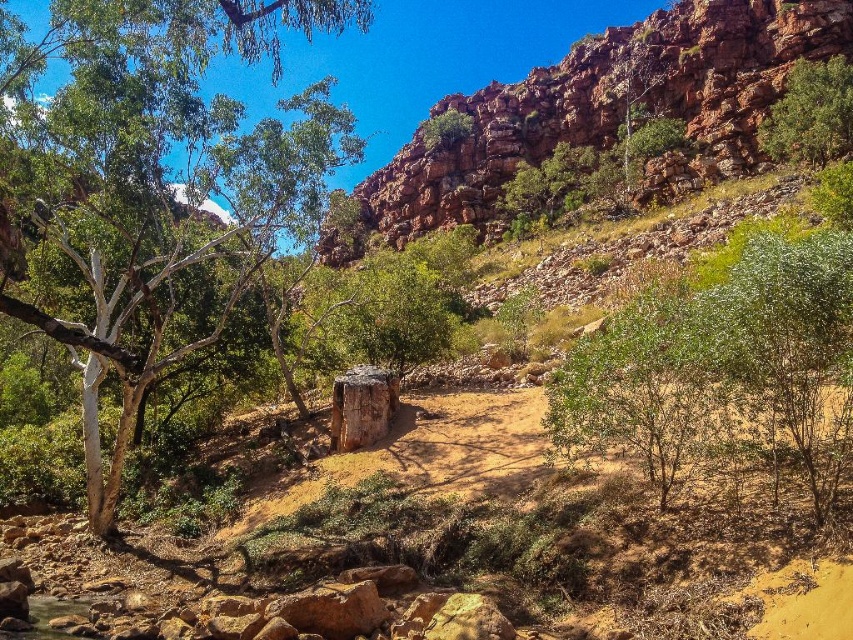
Is green leafy bush at lower right below rusty rock cliff at upper right?

Yes.

Measure the distance between point (838, 448) and camera.

27.72 meters

Identify the location of green leafy bush at lower right. (723, 364).

Does green leafy tree at left have a lesser height compared to rusty rock cliff at upper right?

Incorrect, green leafy tree at left's height does not fall short of rusty rock cliff at upper right's.

Between point (151, 26) and point (721, 136), which one is positioned in front?

Point (151, 26)

Image resolution: width=853 pixels, height=640 pixels. I want to click on green leafy tree at left, so click(x=137, y=179).

This screenshot has width=853, height=640. Describe the element at coordinates (811, 115) in the screenshot. I see `green leafy tree at upper right` at that location.

From the picture: Between green leafy tree at upper right and green leafy tree at upper center, which one has less height?

Standing shorter between the two is green leafy tree at upper right.

Who is more distant from viewer, (790, 147) or (457, 140)?

The point (457, 140) is behind.

Find the location of a particular element. This screenshot has height=640, width=853. green leafy tree at upper right is located at coordinates (811, 115).